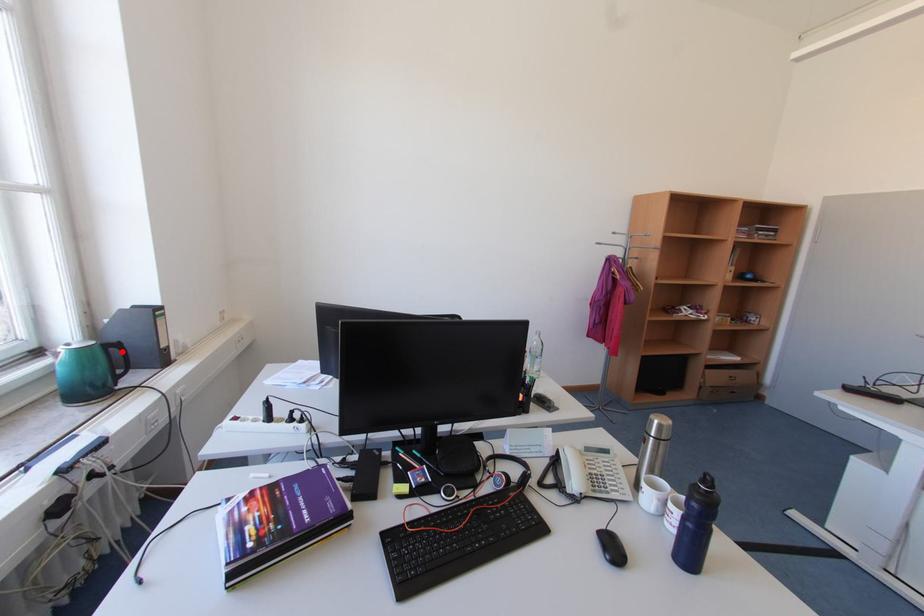
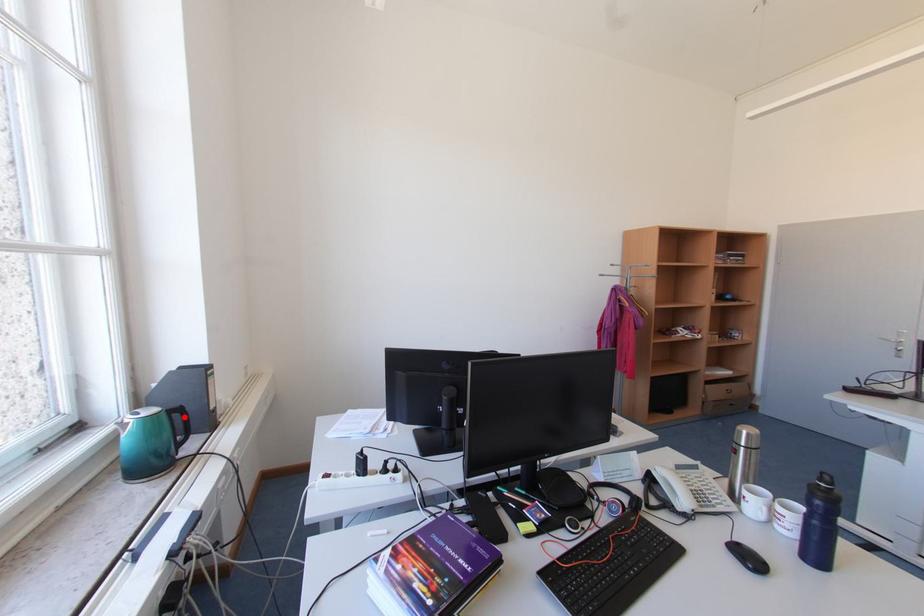
I am providing you with two images of the same scene from different viewpoints. A red point is marked on the first image and another point is marked on the second image. Is the red point in image1 aligned with the point shown in image2?

Yes